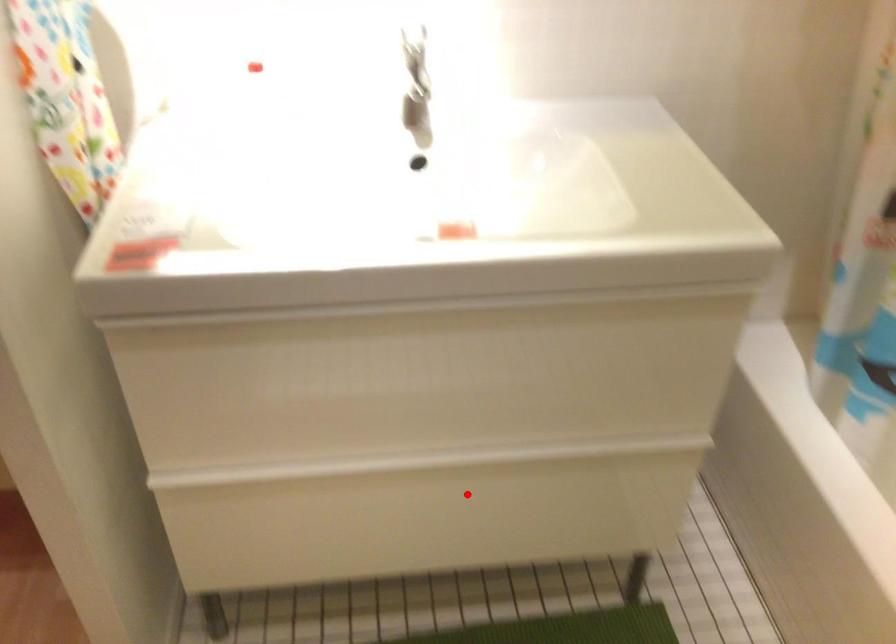
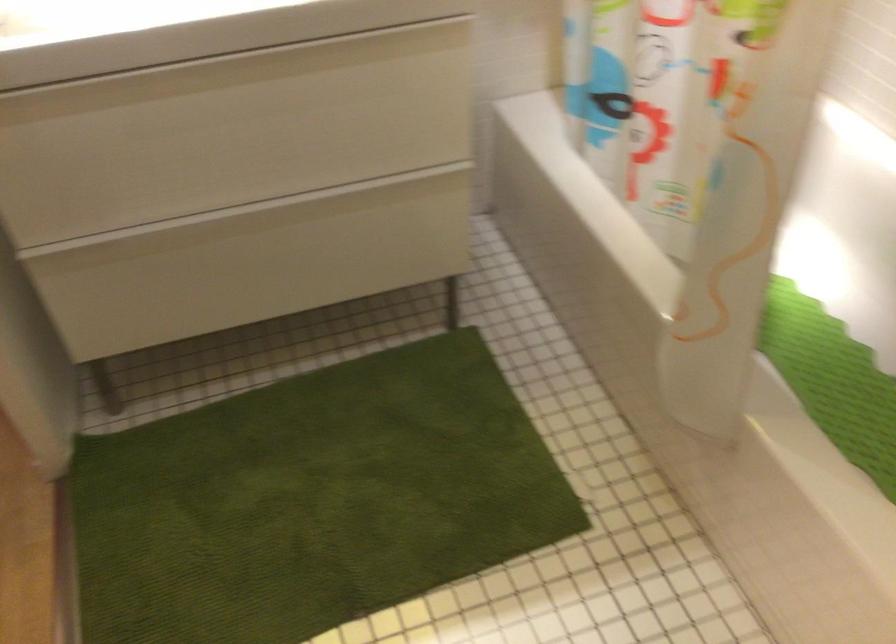
Question: I am providing you with two images of the same scene from different viewpoints. Image1 has a red point marked. In image2, the corresponding 3D location appears at what relative position? Reply with the corresponding letter.

Choices:
 (A) Closer
 (B) Farther

Answer: (B)